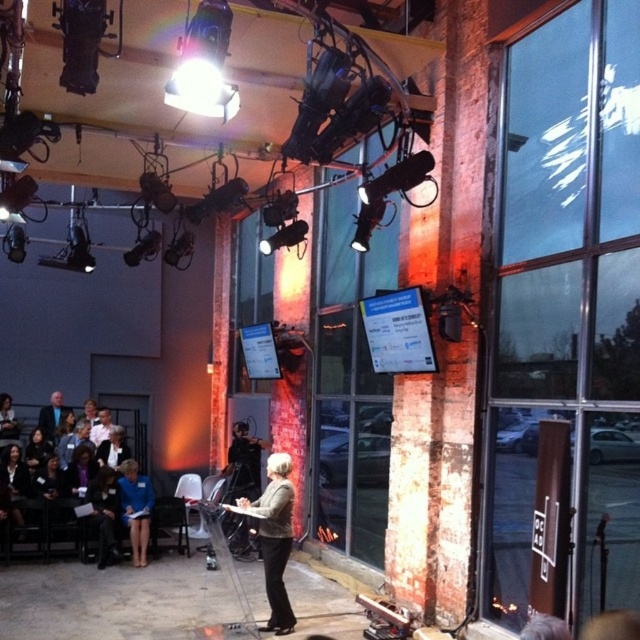
Question: Which of these objects is positioned closest to the dark blue suit at left?

Choices:
 (A) blue fabric jacket at lower left
 (B) gray wool blazer at center

Answer: (A)

Question: Where is blue fabric jacket at lower left located in relation to dark blue suit at left in the image?

Choices:
 (A) left
 (B) right

Answer: (B)

Question: Is gray wool blazer at center positioned before dark blue suit at left?

Choices:
 (A) yes
 (B) no

Answer: (A)

Question: Is blue fabric jacket at lower left behind dark blue suit at left?

Choices:
 (A) no
 (B) yes

Answer: (A)

Question: Which point appears farthest from the camera in this image?

Choices:
 (A) (54, 420)
 (B) (284, 465)

Answer: (A)

Question: Which point is farther to the camera?

Choices:
 (A) dark blue suit at left
 (B) blue fabric jacket at lower left
 (C) gray wool blazer at center

Answer: (A)